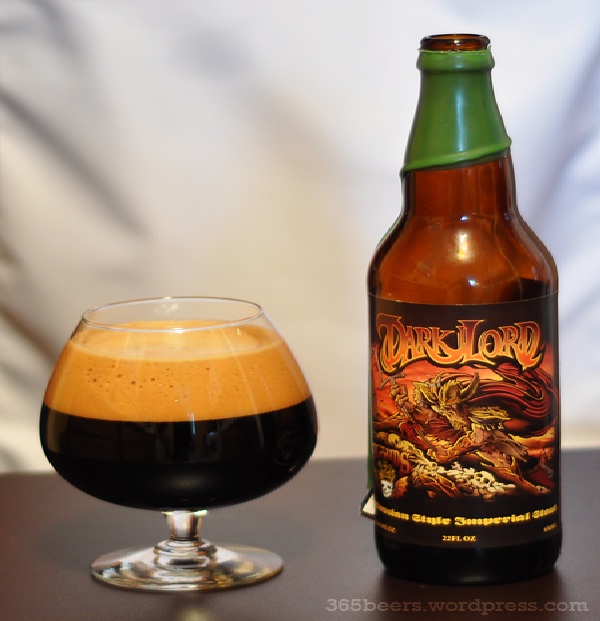
At what (x,y) coordinates should I click in order to perform the action: click on goblet. Please return your answer as a coordinate pair (x, y). The image size is (600, 621). Looking at the image, I should click on (256, 415).